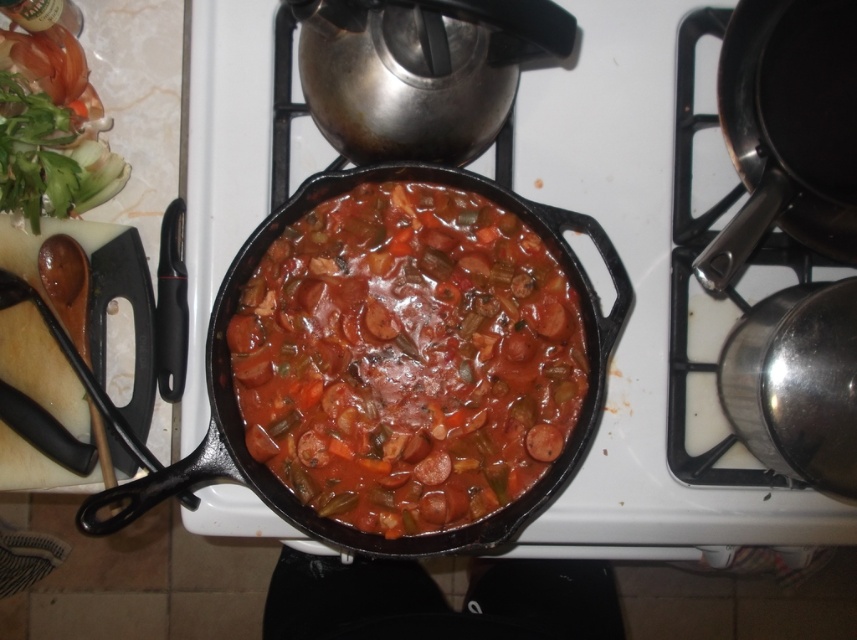
You are a chef preparing a dish and need to move the black cast iron frying pan at upper right to the right side of the cast iron skillet at center. Can you do this without moving the skillet?

The cast iron skillet at center is further to the viewer than the black cast iron frying pan at upper right, so you can move the black cast iron frying pan at upper right to the right side of the cast iron skillet at center without moving the skillet itself.

You are a chef trying to reach the black cast iron frying pan at upper right to stir the contents. However, the black cast iron skillet at center is blocking your access. Can you move the skillet to the side to get to the frying pan?

The black cast iron skillet at center is in front of the black cast iron frying pan at upper right, so moving the skillet would allow access to the frying pan.